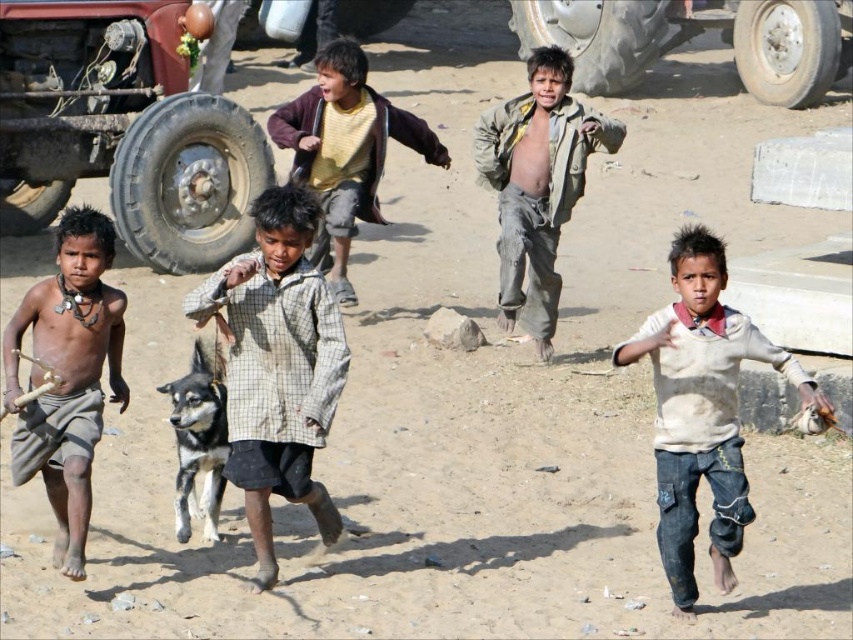
You are a photographer trying to capture a photo of the gray rubber tire at upper right without the dirty gray pants at center blocking it. Can you adjust your position to achieve this?

The dirty gray pants at center is in front of the gray rubber tire at upper right, so moving your position to the side or behind the tire might allow you to capture the tire without obstruction.

You are standing in the scene and want to place a small flag at the point that is closer to you. Which point should you choose between point (688, 561) and point (608, 60)?

You should choose point (688, 561) because it is closer to the viewer than point (608, 60).